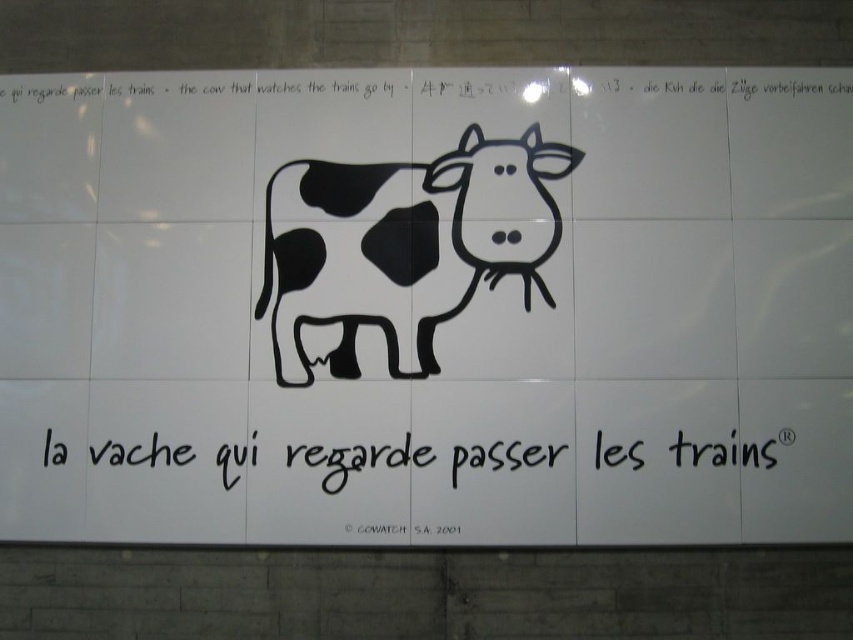
Between black matte cow at center and black ink writing at center, which one is positioned lower?

Positioned lower is black ink writing at center.

Who is more distant from viewer, (375, 244) or (386, 461)?

Point (375, 244)

Identify the location of black matte cow at center. click(405, 252).